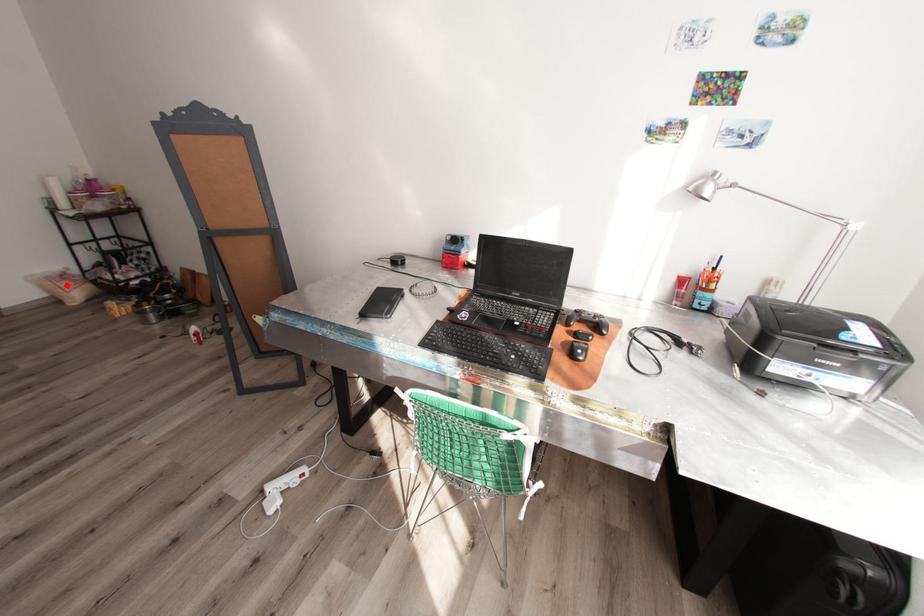
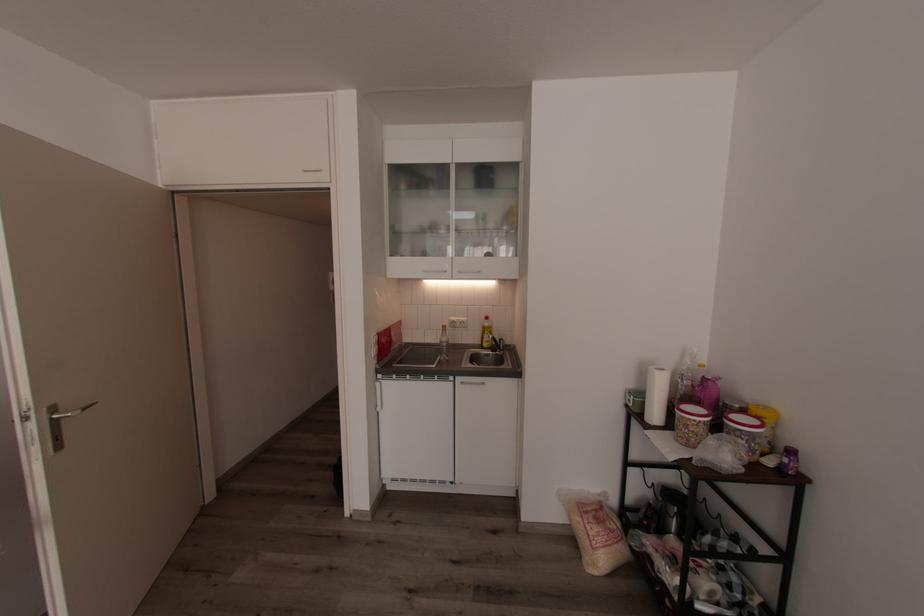
In the second image, find the point that corresponds to the highlighted location in the first image.

(594, 533)